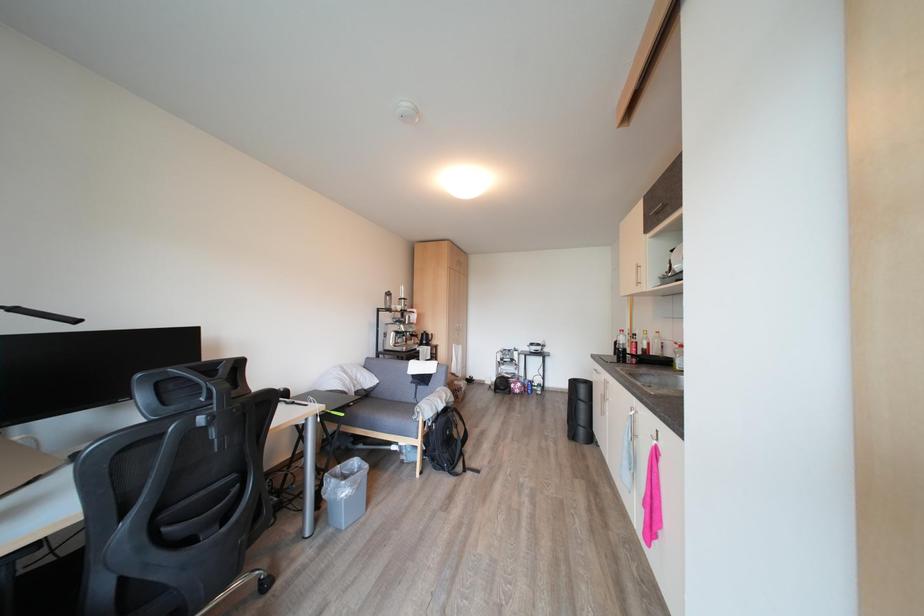
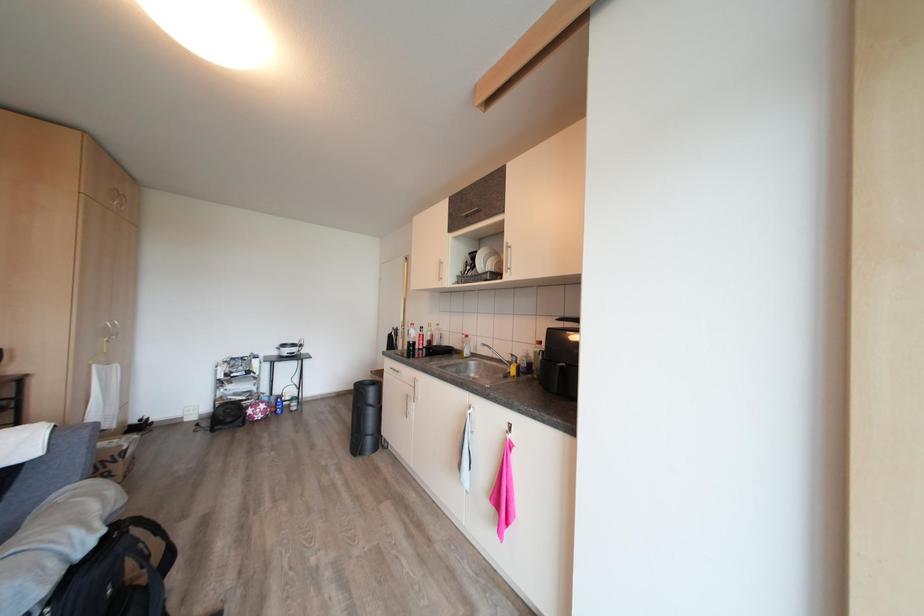
Question: How did the camera likely rotate?

Choices:
 (A) Left
 (B) Right
 (C) Up
 (D) Down

Answer: (B)